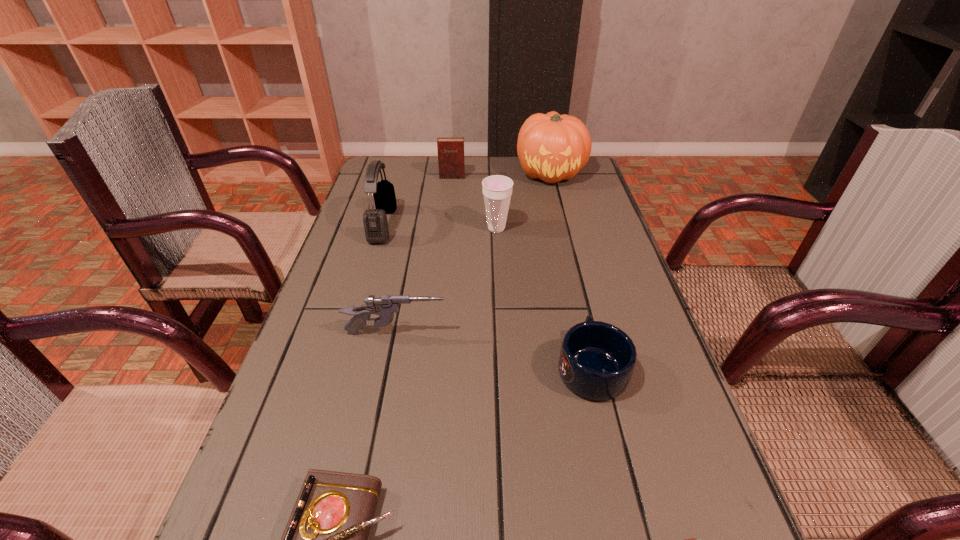
The height and width of the screenshot is (540, 960). What are the coordinates of `object identified as the fifth closest to the farther diary` in the screenshot? It's located at (597, 359).

The width and height of the screenshot is (960, 540). Identify the location of free location that satisfies the following two spatial constraints: 1. with the handle on the side of the mug; 2. on the headband of the headset. (558, 225).

Where is `vacant space that satisfies the following two spatial constraints: 1. on the front cover of the taller diary; 2. on the headband of the headset`? vacant space that satisfies the following two spatial constraints: 1. on the front cover of the taller diary; 2. on the headband of the headset is located at coordinates (447, 225).